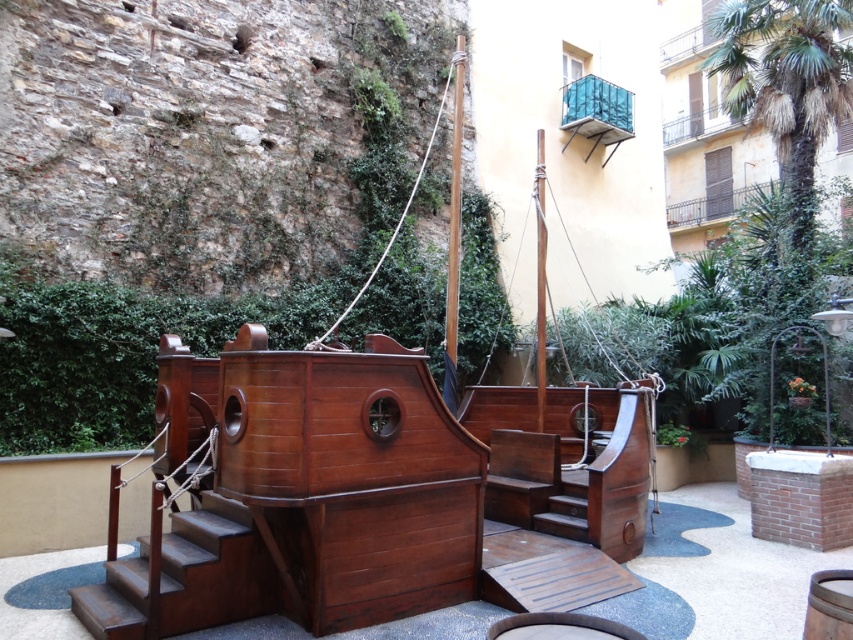
You are standing in the courtyard where the wooden ship replica is displayed. You notice two specific points marked on the ship. The first point is at coordinates point [250,598], and the second point is at point [450,323]. From your vantage point, which of these two points appears closer to you?

Point [250,598] is in front of point [450,323], so it appears closer to you.

You are standing at the base of the shiny brown wood stairs at lower left and want to reach the wooden mast at upper center. Which direction should you move to get closer to the mast?

To reach the wooden mast at upper center from the shiny brown wood stairs at lower left, you should move upward since the stairs are in front of the mast, indicating that ascending the stairs will bring you closer to the mast.

You are a maintenance worker inspecting the wooden ship replica. You need to compare the width of the shiny brown wood stairs at lower left and the smooth brown mast at center. Which one is wider?

The shiny brown wood stairs at lower left are wider than the smooth brown mast at center, as the stairs have a greater width according to the description.